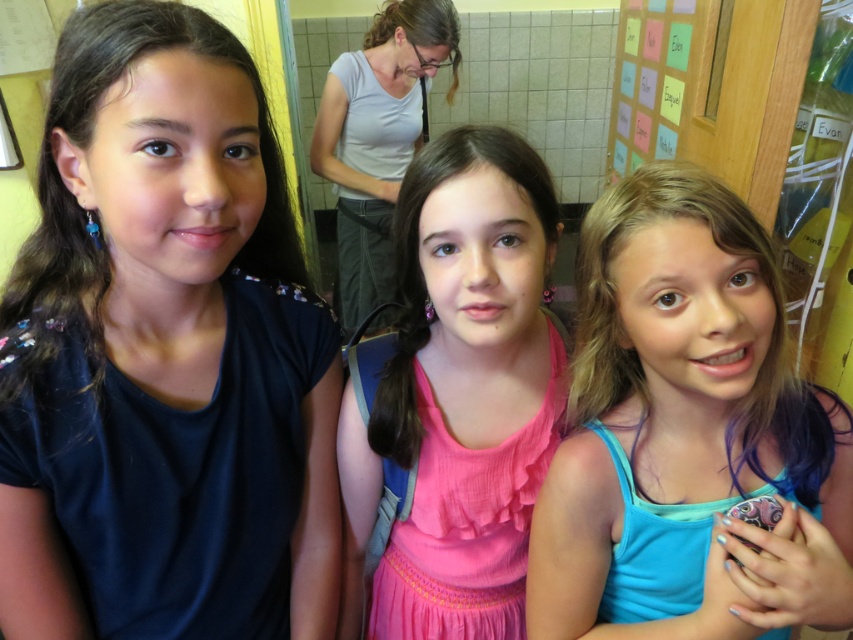
Does pink chiffon dress at center appear on the right side of matte gray shirt at upper left?

Indeed, pink chiffon dress at center is positioned on the right side of matte gray shirt at upper left.

Where is `pink chiffon dress at center`? The width and height of the screenshot is (853, 640). pink chiffon dress at center is located at coordinates (457, 396).

The height and width of the screenshot is (640, 853). What are the coordinates of `pink chiffon dress at center` in the screenshot? It's located at (457, 396).

Which is more to the left, blue fabric shirt at center or pink chiffon dress at center?

From the viewer's perspective, pink chiffon dress at center appears more on the left side.

Which is below, blue fabric shirt at center or pink chiffon dress at center?

Positioned lower is pink chiffon dress at center.

Is point (700, 212) in front of point (412, 628)?

Yes, it is.

The width and height of the screenshot is (853, 640). Identify the location of blue fabric shirt at center. (688, 433).

What do you see at coordinates (169, 339) in the screenshot?
I see `dark blue fabric shirt at left` at bounding box center [169, 339].

You are a GUI agent. You are given a task and a screenshot of the screen. Output one action in this format:
    pyautogui.click(x=<x>, y=<y>)
    Task: Click on the dark blue fabric shirt at left
    The height and width of the screenshot is (640, 853).
    Given the screenshot: What is the action you would take?
    pyautogui.click(x=169, y=339)